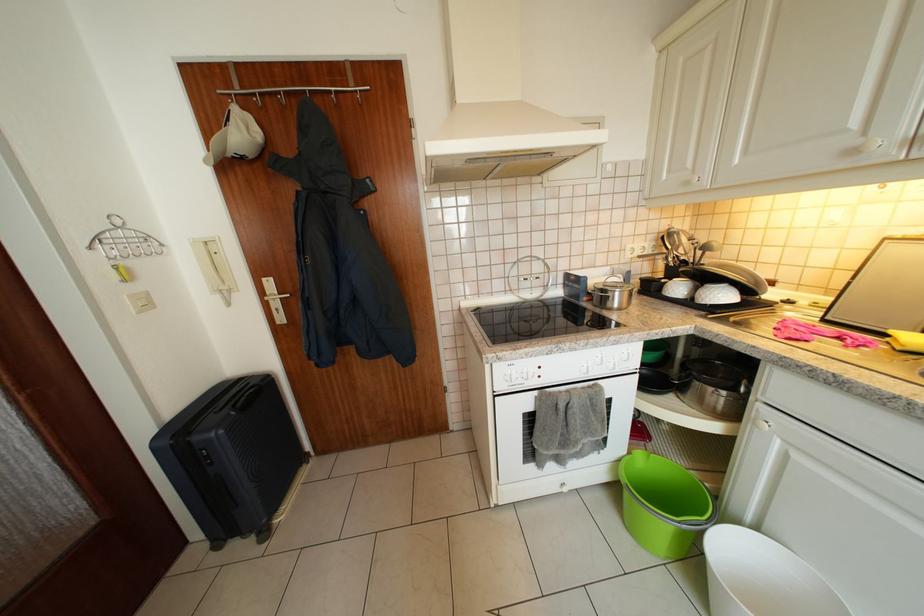
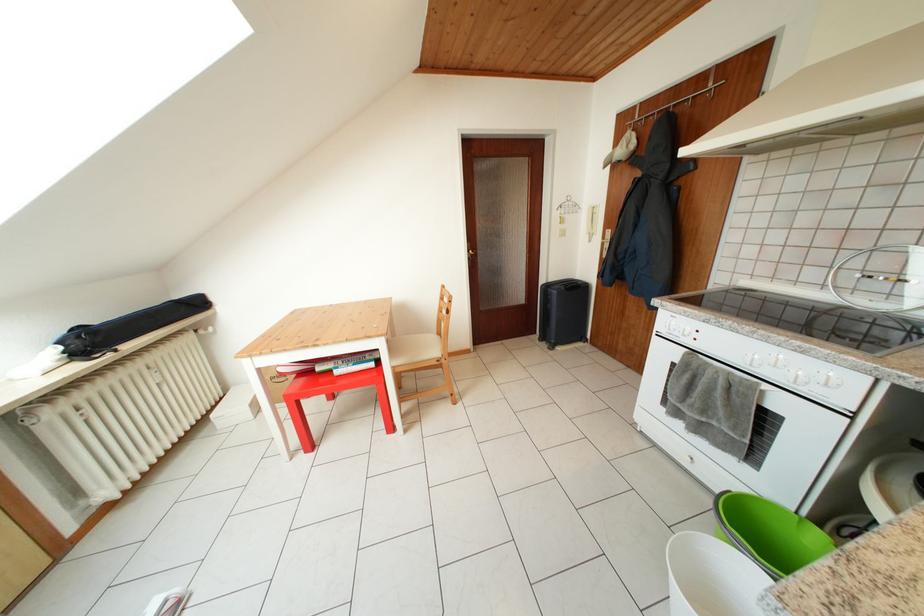
Find the pixel in the second image that matches (648,459) in the first image.

(828, 540)